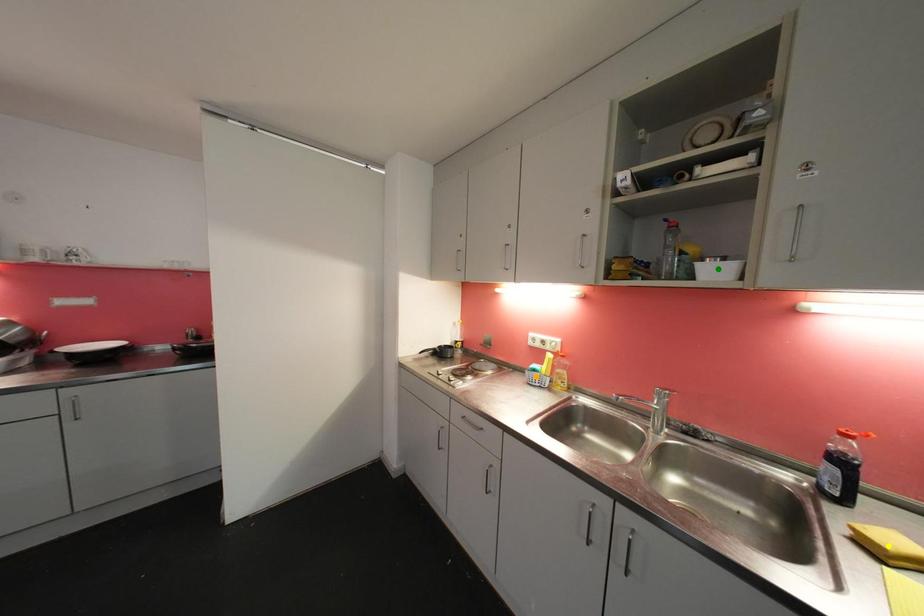
Order these from nearest to farthest:
yellow point
green point
orange point

yellow point < green point < orange point